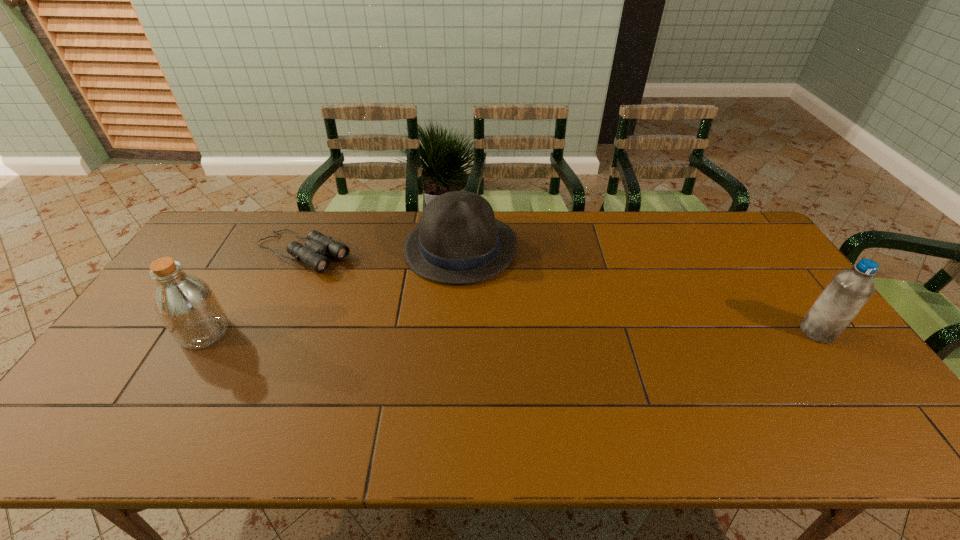
Locate an element on the screen. Image resolution: width=960 pixels, height=540 pixels. vacant space located 0.390m at the eyepiece of the binoculars is located at coordinates (430, 322).

Where is `vacant area located 0.390m at the eyepiece of the binoculars`? This screenshot has height=540, width=960. vacant area located 0.390m at the eyepiece of the binoculars is located at coordinates (430, 322).

This screenshot has width=960, height=540. I want to click on vacant space positioned 0.240m at the eyepiece of the binoculars, so click(x=392, y=299).

Find the location of a particular element. bowler hat that is at the far edge is located at coordinates (458, 240).

At what (x,y) coordinates should I click in order to perform the action: click on binoculars at the far edge. Please return your answer as a coordinate pair (x, y). This screenshot has width=960, height=540. Looking at the image, I should click on (317, 244).

Where is `object at the left edge`? object at the left edge is located at coordinates (188, 307).

Find the location of a particular element. Image resolution: width=960 pixels, height=540 pixels. object that is at the right edge is located at coordinates (848, 291).

In the image, there is a desktop. What are the coordinates of `vacant space at the far edge` in the screenshot? It's located at (597, 238).

You are a GUI agent. You are given a task and a screenshot of the screen. Output one action in this format:
    pyautogui.click(x=<x>, y=<y>)
    Task: Click on the free space at the near edge of the desktop
    The height and width of the screenshot is (540, 960).
    Given the screenshot: What is the action you would take?
    pyautogui.click(x=761, y=402)

Find the location of a particular element. The width and height of the screenshot is (960, 540). blank space at the left edge of the desktop is located at coordinates (176, 349).